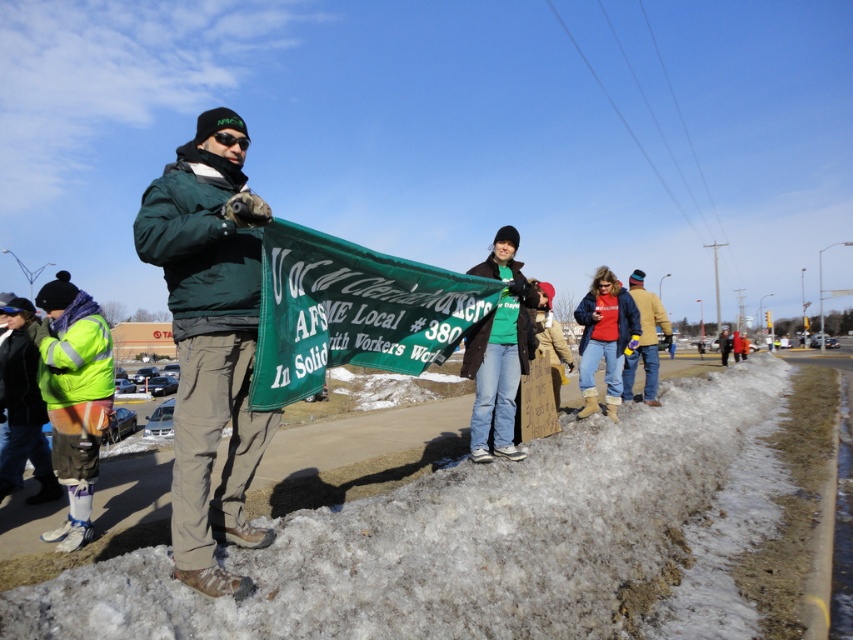
Between point (637, 634) and point (57, 401), which one is positioned behind?

Positioned behind is point (57, 401).

From the picture: Which of these two, white fluffy snow at lower center or high-visibility yellow jacket at lower left, stands shorter?

With less height is white fluffy snow at lower center.

Is point (612, 544) positioned in front of point (67, 323)?

Yes, point (612, 544) is closer to viewer.

I want to click on white fluffy snow at lower center, so click(x=457, y=541).

You are a GUI agent. You are given a task and a screenshot of the screen. Output one action in this format:
    pyautogui.click(x=<x>, y=<y>)
    Task: Click on the high-visibility yellow jacket at lower left
    
    Given the screenshot: What is the action you would take?
    pyautogui.click(x=74, y=397)

Can you confirm if high-visibility yellow jacket at lower left is positioned above reflective yellow safety vest at lower left?

Yes.

In order to click on high-visibility yellow jacket at lower left in this screenshot , I will do pos(74,397).

Does green fabric banner at center have a lesser width compared to red cotton shirt at center?

No, green fabric banner at center is not thinner than red cotton shirt at center.

Looking at this image, between green fabric banner at center and red cotton shirt at center, which one is positioned lower?

Positioned lower is red cotton shirt at center.

You are a GUI agent. You are given a task and a screenshot of the screen. Output one action in this format:
    pyautogui.click(x=<x>, y=<y>)
    Task: Click on the green fabric banner at center
    
    Given the screenshot: What is the action you would take?
    [x=352, y=310]